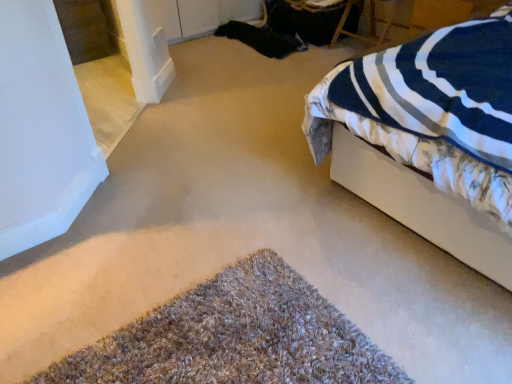
Question: From their relative heights in the image, would you say wooden chair at upper right is taller or shorter than brown shaggy carpet at lower center?

Choices:
 (A) short
 (B) tall

Answer: (B)

Question: From the image's perspective, relative to brown shaggy carpet at lower center, is wooden chair at upper right above or below?

Choices:
 (A) below
 (B) above

Answer: (B)

Question: Estimate the real-world distances between objects in this image. Which object is closer to the brown shaggy carpet at lower center?

Choices:
 (A) white fabric bed at right
 (B) wooden chair at upper right

Answer: (A)

Question: Which object is the farthest from the brown shaggy carpet at lower center?

Choices:
 (A) white fabric bed at right
 (B) wooden chair at upper right

Answer: (B)